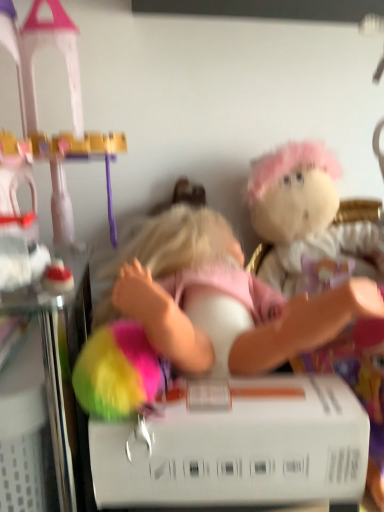
Question: Is fluffy white plush at upper right wider than white matte box at center?

Choices:
 (A) yes
 (B) no

Answer: (A)

Question: Is fluffy white plush at upper right oriented away from white matte box at center?

Choices:
 (A) no
 (B) yes

Answer: (A)

Question: Are fluffy white plush at upper right and white matte box at center far apart?

Choices:
 (A) no
 (B) yes

Answer: (A)

Question: Considering the relative sizes of fluffy white plush at upper right and white matte box at center in the image provided, is fluffy white plush at upper right smaller than white matte box at center?

Choices:
 (A) yes
 (B) no

Answer: (B)

Question: From the image's perspective, would you say fluffy white plush at upper right is positioned over white matte box at center?

Choices:
 (A) yes
 (B) no

Answer: (A)

Question: Is the position of fluffy white plush at upper right less distant than that of white matte box at center?

Choices:
 (A) no
 (B) yes

Answer: (A)

Question: Considering the relative positions of fluffy white plush at upper right and pink fabric doll at center in the image provided, is fluffy white plush at upper right to the right of pink fabric doll at center from the viewer's perspective?

Choices:
 (A) yes
 (B) no

Answer: (A)

Question: Is fluffy white plush at upper right directly adjacent to pink fabric doll at center?

Choices:
 (A) no
 (B) yes

Answer: (A)

Question: Is fluffy white plush at upper right taller than pink fabric doll at center?

Choices:
 (A) yes
 (B) no

Answer: (A)

Question: Is fluffy white plush at upper right far from pink fabric doll at center?

Choices:
 (A) no
 (B) yes

Answer: (A)

Question: From a real-world perspective, is fluffy white plush at upper right under pink fabric doll at center?

Choices:
 (A) yes
 (B) no

Answer: (B)

Question: Is fluffy white plush at upper right located outside pink fabric doll at center?

Choices:
 (A) no
 (B) yes

Answer: (B)

Question: Is pink fabric doll at center positioned with its back to fluffy white plush at upper right?

Choices:
 (A) no
 (B) yes

Answer: (A)